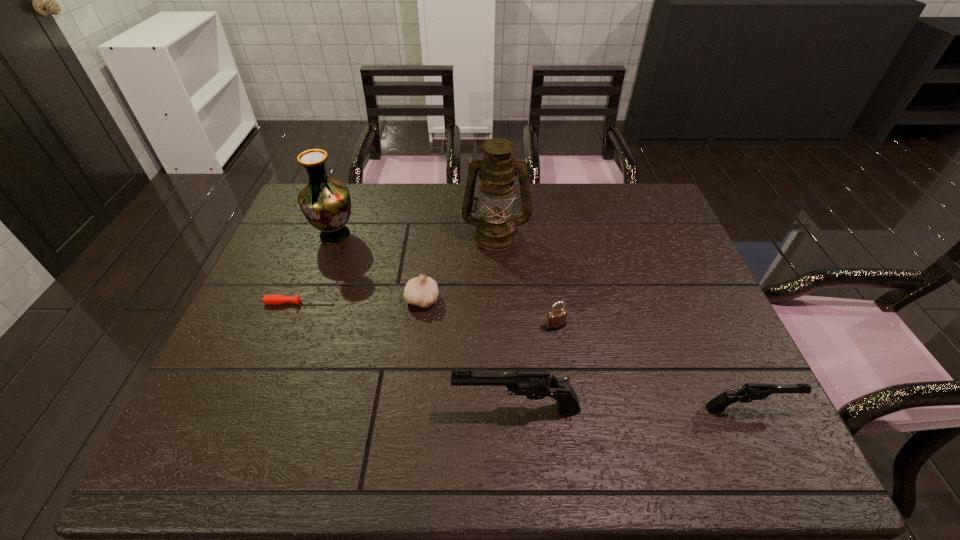
Identify the location of vacant space located at the end of the barrel of the third tallest object. (397, 408).

Find the location of a particular element. This screenshot has height=540, width=960. vacant region located 0.210m at the end of the barrel of the third tallest object is located at coordinates (356, 408).

What are the coordinates of `vacant space located 0.100m on the back of the third object from left to right` in the screenshot? It's located at (427, 262).

Find the location of `free region located 0.050m on the back of the oil lamp`. free region located 0.050m on the back of the oil lamp is located at coordinates (495, 210).

Where is `vacant space located 0.280m on the front of the vase`? vacant space located 0.280m on the front of the vase is located at coordinates (303, 325).

In order to click on vacant space situated on the left of the padlock in this screenshot , I will do `click(480, 326)`.

Find the location of a particular element. Image resolution: width=960 pixels, height=540 pixels. vacant area situated 0.120m at the tip of the shortest object is located at coordinates click(x=379, y=302).

Locate an element on the screen. Image resolution: width=960 pixels, height=540 pixels. oil lamp at the far edge is located at coordinates (496, 230).

At what (x,y) coordinates should I click in order to perform the action: click on vase that is at the far edge. Please return your answer as a coordinate pair (x, y). Looking at the image, I should click on (325, 202).

Locate an element on the screen. This screenshot has width=960, height=540. vase located at the left edge is located at coordinates (325, 202).